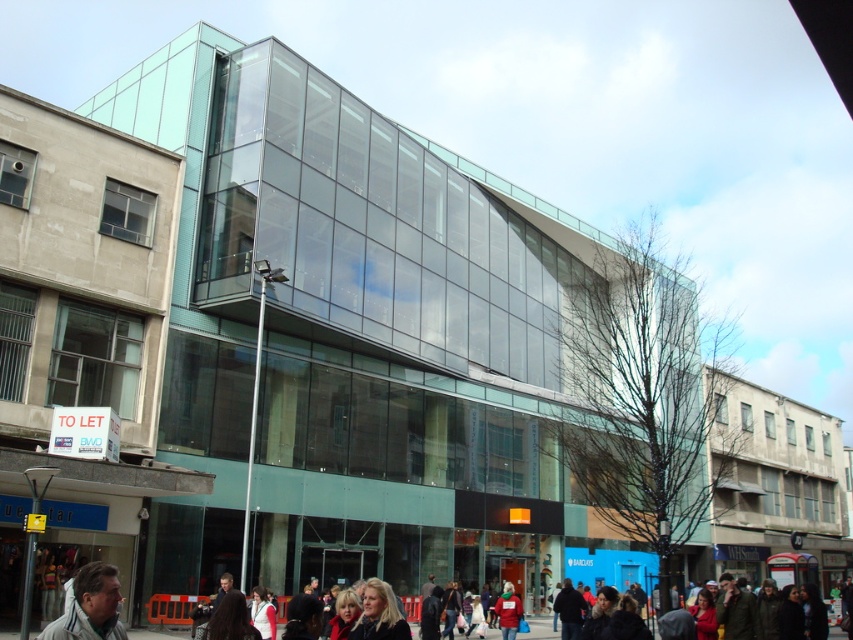
From the picture: You are a photographer standing on the sidewalk in front of the modern building. You want to take a photo of the red knit hat at lower center but also want the gray fabric jacket at lower left to be visible in the background. Is this possible given their positions?

The gray fabric jacket at lower left is in front of the red knit hat at lower center, so if you position yourself to capture the gray fabric jacket at lower left in the foreground, the red knit hat at lower center will naturally appear in the background.

You are a photographer trying to capture a clear shot of the modern building. However, there are two people blocking your view at the lower center of your frame. The first person has blonde hair at lower center and the second has a red knit hat at lower center. Which of the two is more likely to be blocking the building in your photo?

The blonde hair at lower center is more likely to be blocking the building in your photo because it is bigger than the red knit hat at lower center.

You are a photographer standing in front of the modern building. You want to take a photo of the gray fabric jacket at lower left and the blonde hair at lower center. Which object is wider in the image?

The gray fabric jacket at lower left might be wider than blonde hair at lower center according to the description.